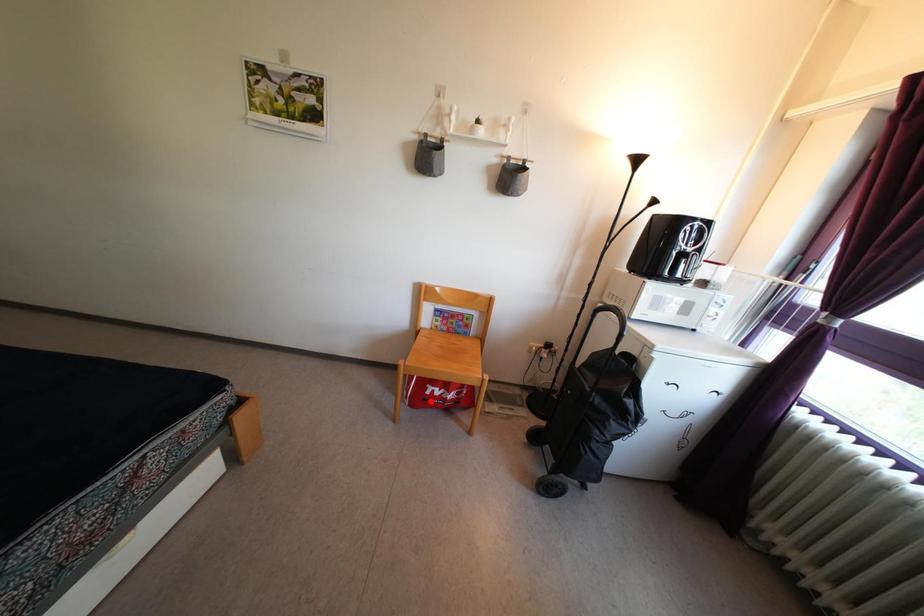
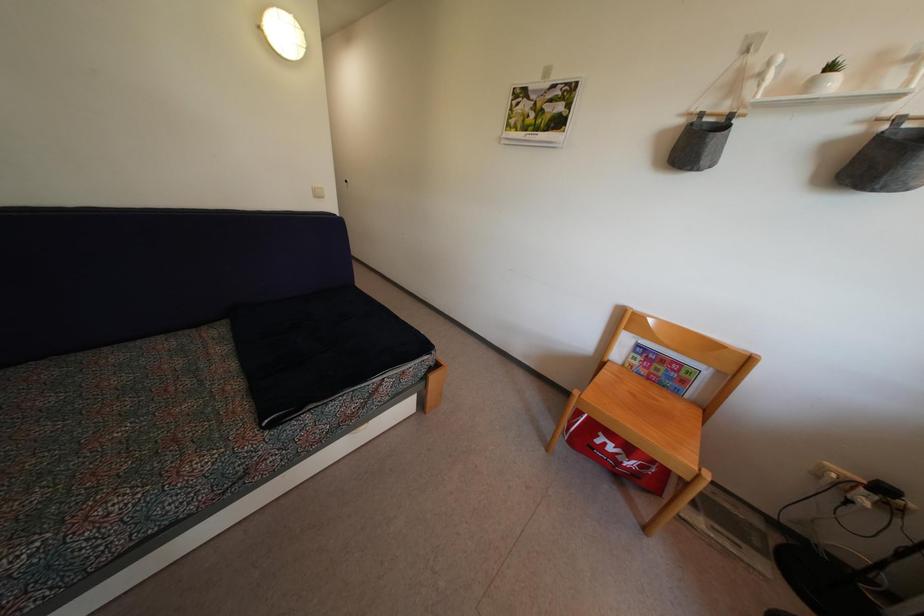
Question: I am providing you with two images of the same scene from different viewpoints. Given a red point in image1, look at the same physical point in image2. Is it:

Choices:
 (A) Closer to the viewpoint
 (B) Farther from the viewpoint

Answer: (B)